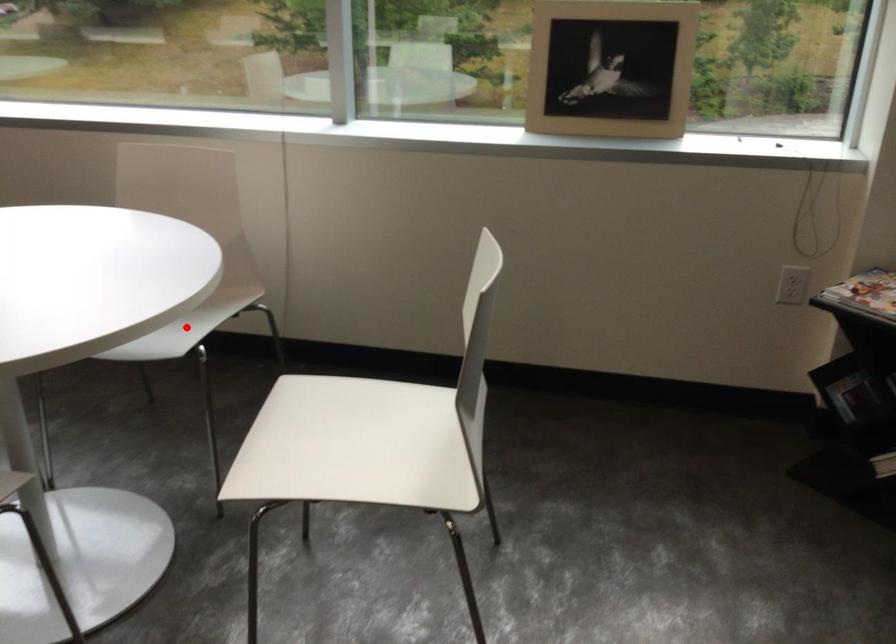
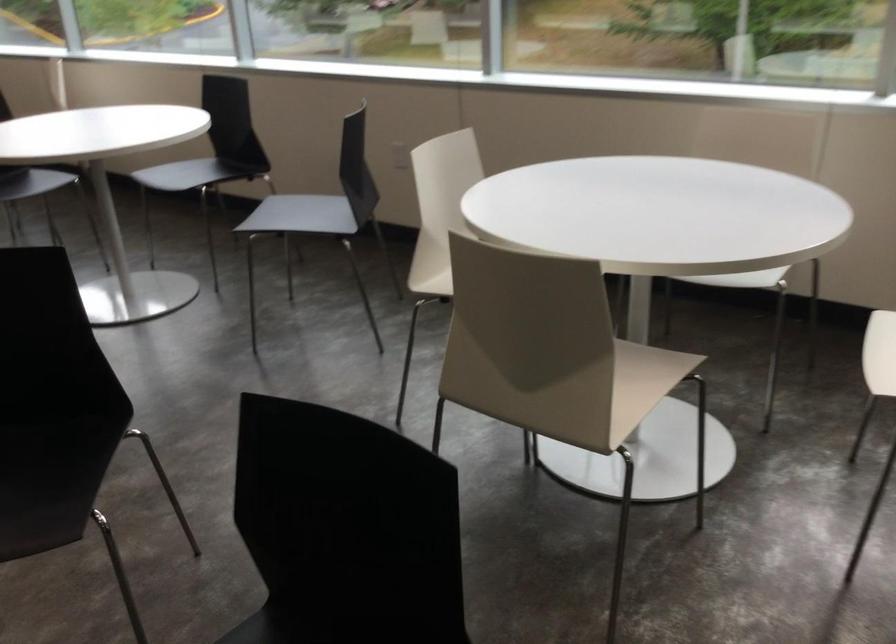
Question: I am providing you with two images of the same scene from different viewpoints. A red point is marked on the first image. Is the red point's position out of view in image 2?

Choices:
 (A) Yes
 (B) No

Answer: (A)